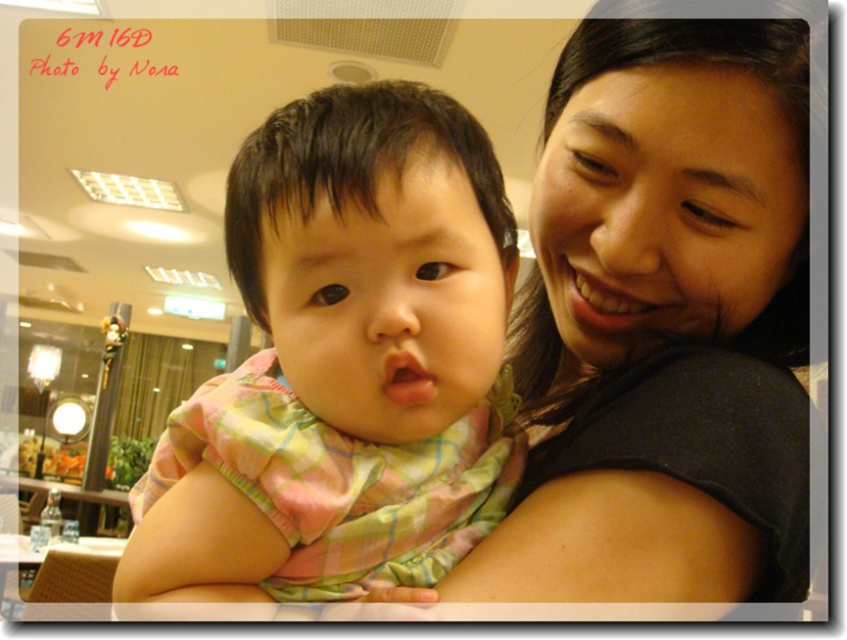
Find the location of a particular element. The width and height of the screenshot is (847, 640). matte black shirt at center is located at coordinates (662, 324).

Does matte black shirt at center have a larger size compared to pink plaid shirt at center?

Yes, matte black shirt at center is bigger than pink plaid shirt at center.

Find the location of a particular element. This screenshot has height=640, width=847. matte black shirt at center is located at coordinates (662, 324).